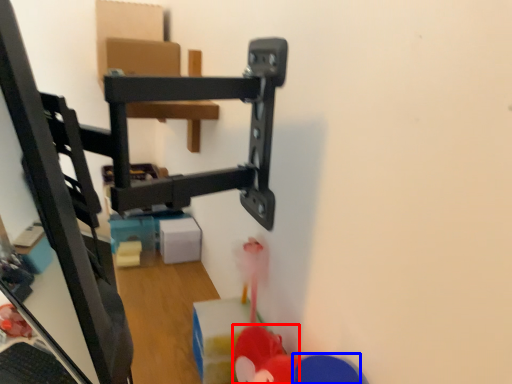
Question: Which of the following is the farthest to the observer, toy (highlighted by a red box) or toy (highlighted by a blue box)?

Choices:
 (A) toy
 (B) toy

Answer: (A)